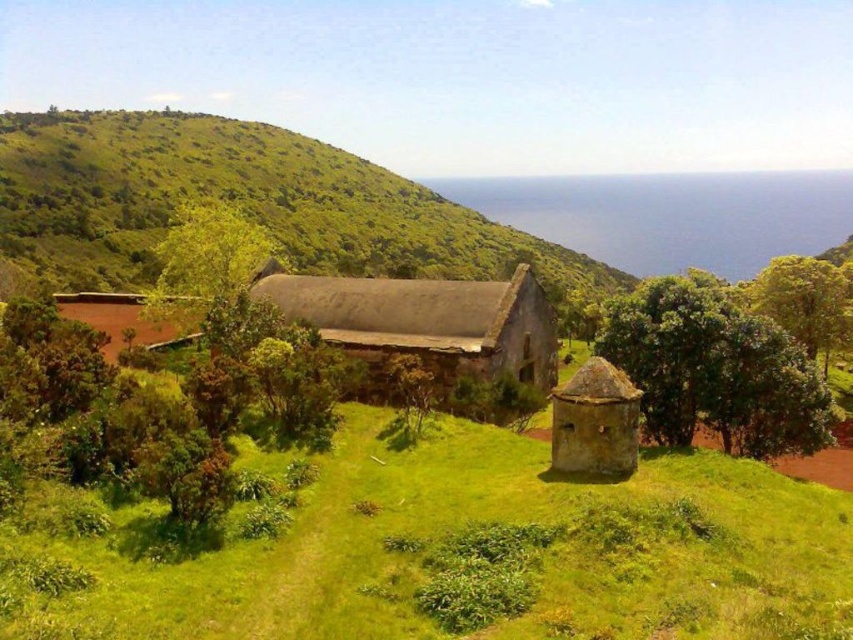
Question: Where is green grassy at center located in relation to green leafy tree at center-right in the image?

Choices:
 (A) right
 (B) left

Answer: (B)

Question: Which point is farther to the camera?

Choices:
 (A) (538, 522)
 (B) (78, 305)
 (C) (239, 269)
 (D) (813, 275)

Answer: (B)

Question: Is rusty metal hut at center further to camera compared to green leafy tree at center?

Choices:
 (A) yes
 (B) no

Answer: (A)

Question: Among these points, which one is nearest to the camera?

Choices:
 (A) (743, 419)
 (B) (183, 330)
 (C) (10, 193)
 (D) (235, 248)

Answer: (A)

Question: Estimate the real-world distances between objects in this image. Which object is farther from the yellow-green leafy tree at right?

Choices:
 (A) green grassy at center
 (B) green grassy hillside at center
 (C) green leafy tree at center-right

Answer: (B)

Question: Where is green leafy tree at center-right located in relation to rusty metal hut at center in the image?

Choices:
 (A) right
 (B) left

Answer: (A)